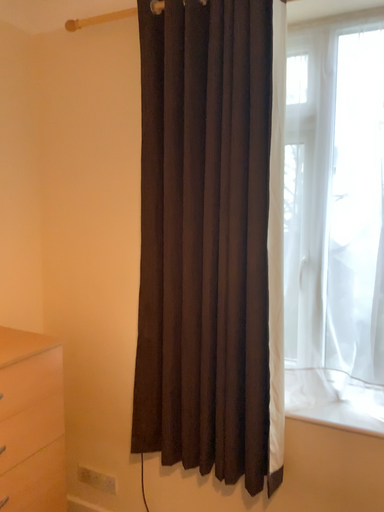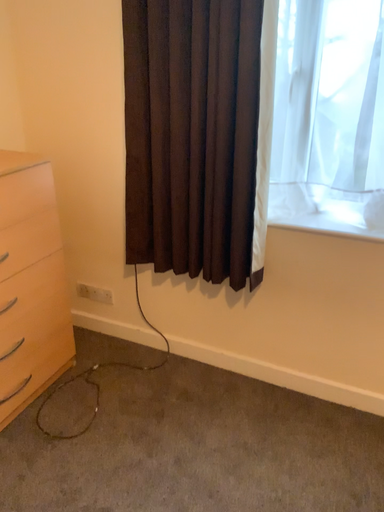
Question: How did the camera likely rotate when shooting the video?

Choices:
 (A) rotated downward
 (B) rotated upward

Answer: (A)